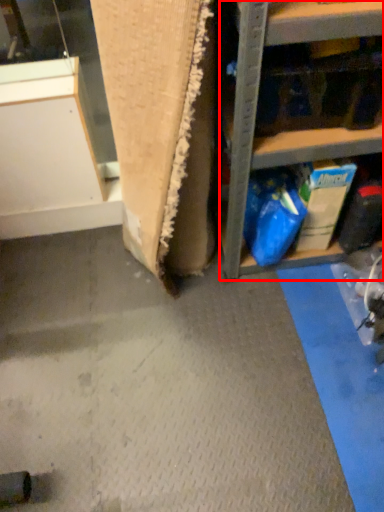
Question: Where is shelf (annotated by the red box) located in relation to cabinetry in the image?

Choices:
 (A) left
 (B) right

Answer: (B)